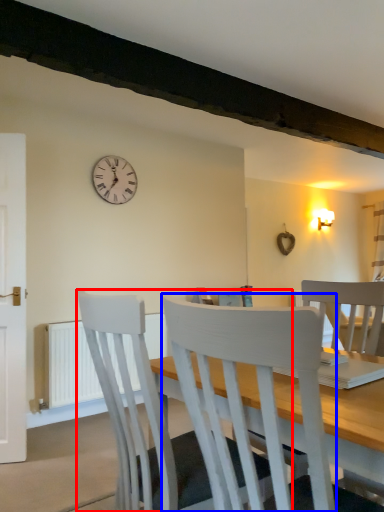
Question: Which point is closer to the camera, chair (highlighted by a red box) or chair (highlighted by a blue box)?

Choices:
 (A) chair
 (B) chair

Answer: (B)